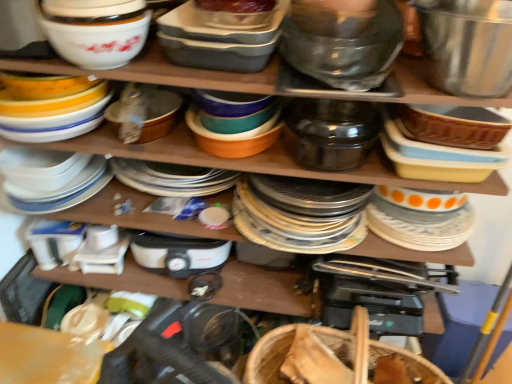
Describe the element at coordinates (52, 108) in the screenshot. I see `white glossy bowl at upper left, the 2th appliance when ordered from right to left` at that location.

Where is `white glossy plate at upper right`? white glossy plate at upper right is located at coordinates (419, 219).

In order to face translucent plastic container at upper center, which is the 2th bowl in left-to-right order, should I rotate leftwards or rightwards?

You should rotate left by 3.914 degrees.

Measure the distance between point (483, 61) and camera.

Point (483, 61) and camera are 29.21 inches apart.

At what (x,y) coordinates should I click in order to perform the action: click on transparent plastic bowl at upper center, which is the second bowl from right to left. Please return your answer as a coordinate pair (x, y). The height and width of the screenshot is (384, 512). Looking at the image, I should click on click(x=342, y=44).

Identify the location of white glossy bowl at upper left, the 1th bowl in the left-to-right sequence. The height and width of the screenshot is (384, 512). (96, 30).

From a real-world perspective, does shiny metallic bowl at upper right, arranged as the fourth bowl when viewed from the left, stand above white glossy bowl at upper left, the 2th appliance when ordered from right to left?

Yes.

From the image's perspective, which bowl is the 1st one above the white glossy bowl at upper left, positioned as the 1th appliance in left-to-right order? Please provide its 2D coordinates.

[(467, 45)]

Is shiny metallic bowl at upper right, arranged as the first bowl when viewed from the right, bigger than white glossy bowl at upper left, the 2th appliance when ordered from right to left?

Actually, shiny metallic bowl at upper right, arranged as the first bowl when viewed from the right, might be smaller than white glossy bowl at upper left, the 2th appliance when ordered from right to left.

Measure the distance between shiny metallic bowl at upper right, arranged as the first bowl when viewed from the right, and white glossy bowl at upper left, the 2th appliance when ordered from right to left.

shiny metallic bowl at upper right, arranged as the first bowl when viewed from the right, is 31.59 inches away from white glossy bowl at upper left, the 2th appliance when ordered from right to left.

I want to click on the 1st appliance behind the shiny metallic bowl at upper right, arranged as the first bowl when viewed from the right, counting from the anchor's position, so click(x=330, y=133).

From a real-world perspective, relative to shiny metallic bowl at upper right, arranged as the fourth bowl when viewed from the left, is satin black pot at center, which is the 1th appliance in right-to-left order, vertically above or below?

From a real-world perspective, satin black pot at center, which is the 1th appliance in right-to-left order, is physically below shiny metallic bowl at upper right, arranged as the fourth bowl when viewed from the left.

Is satin black pot at center, which is counted as the 2th appliance, starting from the left, not inside shiny metallic bowl at upper right, arranged as the first bowl when viewed from the right?

Yes, satin black pot at center, which is counted as the 2th appliance, starting from the left, is not within shiny metallic bowl at upper right, arranged as the first bowl when viewed from the right.

Which is in front, satin black pot at center, which is the 1th appliance in right-to-left order, or shiny metallic bowl at upper right, arranged as the first bowl when viewed from the right?

Positioned in front is shiny metallic bowl at upper right, arranged as the first bowl when viewed from the right.

Based on the photo, considering the relative sizes of white glossy plate at upper right and shiny metallic bowl at upper right, arranged as the first bowl when viewed from the right, in the image provided, is white glossy plate at upper right smaller than shiny metallic bowl at upper right, arranged as the first bowl when viewed from the right,?

Yes.

Based on the photo, from the image's perspective, relative to shiny metallic bowl at upper right, arranged as the fourth bowl when viewed from the left, is white glossy plate at upper right above or below?

From the image's perspective, white glossy plate at upper right appears below shiny metallic bowl at upper right, arranged as the fourth bowl when viewed from the left.

Is white glossy plate at upper right aimed at shiny metallic bowl at upper right, arranged as the fourth bowl when viewed from the left?

No, white glossy plate at upper right is not facing towards shiny metallic bowl at upper right, arranged as the fourth bowl when viewed from the left.

Does white glossy plate at upper right have a greater width compared to transparent plastic bowl at upper center, marked as the 3th bowl in a left-to-right arrangement?

No, white glossy plate at upper right is not wider than transparent plastic bowl at upper center, marked as the 3th bowl in a left-to-right arrangement.

In terms of height, does white glossy plate at upper right look taller or shorter compared to transparent plastic bowl at upper center, which is the second bowl from right to left?

In the image, white glossy plate at upper right appears to be shorter than transparent plastic bowl at upper center, which is the second bowl from right to left.

Are white glossy plate at upper right and transparent plastic bowl at upper center, which is the second bowl from right to left, far apart?

No, there isn't a large distance between white glossy plate at upper right and transparent plastic bowl at upper center, which is the second bowl from right to left.

The width and height of the screenshot is (512, 384). In order to click on tableware below the transparent plastic bowl at upper center, which is the second bowl from right to left (from a real-world perspective) in this screenshot , I will do click(x=419, y=219).

From a real-world perspective, between translucent plastic container at upper center, which is the 3th bowl in right-to-left order, and transparent plastic bowl at upper center, which is the second bowl from right to left, who is vertically lower?

transparent plastic bowl at upper center, which is the second bowl from right to left, is physically lower.

Which is more to the right, translucent plastic container at upper center, which is the 3th bowl in right-to-left order, or transparent plastic bowl at upper center, marked as the 3th bowl in a left-to-right arrangement?

Positioned to the right is transparent plastic bowl at upper center, marked as the 3th bowl in a left-to-right arrangement.

Can transparent plastic bowl at upper center, marked as the 3th bowl in a left-to-right arrangement, be found inside translucent plastic container at upper center, which is the 3th bowl in right-to-left order?

No, translucent plastic container at upper center, which is the 3th bowl in right-to-left order, does not contain transparent plastic bowl at upper center, marked as the 3th bowl in a left-to-right arrangement.

Considering the relative sizes of bamboo weave basket at lower center and white glossy bowl at upper left, the 2th appliance when ordered from right to left, in the image provided, is bamboo weave basket at lower center wider than white glossy bowl at upper left, the 2th appliance when ordered from right to left,?

In fact, bamboo weave basket at lower center might be narrower than white glossy bowl at upper left, the 2th appliance when ordered from right to left.

Considering the relative sizes of bamboo weave basket at lower center and white glossy bowl at upper left, the 2th appliance when ordered from right to left, in the image provided, is bamboo weave basket at lower center bigger than white glossy bowl at upper left, the 2th appliance when ordered from right to left,?

Indeed, bamboo weave basket at lower center has a larger size compared to white glossy bowl at upper left, the 2th appliance when ordered from right to left.

In the image, is bamboo weave basket at lower center on the left side or the right side of white glossy bowl at upper left, the 2th appliance when ordered from right to left?

bamboo weave basket at lower center is positioned on white glossy bowl at upper left, the 2th appliance when ordered from right to left,'s right side.

Considering the points (391, 363) and (13, 127), which point is in front, point (391, 363) or point (13, 127)?

The point (13, 127) is in front.

From a real-world perspective, is shiny metallic bowl at upper right, arranged as the first bowl when viewed from the right, physically above satin black pot at center, which is counted as the 2th appliance, starting from the left?

Yes, from a real-world perspective, shiny metallic bowl at upper right, arranged as the first bowl when viewed from the right, is on top of satin black pot at center, which is counted as the 2th appliance, starting from the left.

Is shiny metallic bowl at upper right, arranged as the fourth bowl when viewed from the left, oriented towards satin black pot at center, which is counted as the 2th appliance, starting from the left?

No, shiny metallic bowl at upper right, arranged as the fourth bowl when viewed from the left, does not turn towards satin black pot at center, which is counted as the 2th appliance, starting from the left.

From the image's perspective, which is below, shiny metallic bowl at upper right, arranged as the first bowl when viewed from the right, or satin black pot at center, which is counted as the 2th appliance, starting from the left?

satin black pot at center, which is counted as the 2th appliance, starting from the left.

Can you confirm if shiny metallic bowl at upper right, arranged as the first bowl when viewed from the right, is thinner than satin black pot at center, which is the 1th appliance in right-to-left order?

No, shiny metallic bowl at upper right, arranged as the first bowl when viewed from the right, is not thinner than satin black pot at center, which is the 1th appliance in right-to-left order.

You are a GUI agent. You are given a task and a screenshot of the screen. Output one action in this format:
    pyautogui.click(x=<x>, y=<y>)
    Task: Click on the 3rd bowl above the white glossy bowl at upper left, positioned as the 1th appliance in left-to-right order (from a real-world perspective)
    This screenshot has width=512, height=384.
    Given the screenshot: What is the action you would take?
    pyautogui.click(x=467, y=45)

From a real-world perspective, starting from the shiny metallic bowl at upper right, arranged as the first bowl when viewed from the right, which appliance is the 2nd one below it? Please provide its 2D coordinates.

[(330, 133)]

When comparing their distances from white glossy bowl at upper left, the 2th appliance when ordered from right to left, does bamboo weave basket at lower center or white glossy bowl at upper left, marked as the 4th bowl in a right-to-left arrangement, seem further?

Based on the image, bamboo weave basket at lower center appears to be further to white glossy bowl at upper left, the 2th appliance when ordered from right to left.

From the image, which object appears to be farther from white glossy bowl at upper left, marked as the 4th bowl in a right-to-left arrangement, satin black pot at center, which is the 1th appliance in right-to-left order, or bamboo weave basket at lower center?

Among the two, bamboo weave basket at lower center is located further to white glossy bowl at upper left, marked as the 4th bowl in a right-to-left arrangement.

When comparing their distances from transparent plastic bowl at upper center, marked as the 3th bowl in a left-to-right arrangement, does shiny metallic bowl at upper right, arranged as the first bowl when viewed from the right, or translucent plastic container at upper center, which is the 2th bowl in left-to-right order, seem closer?

The object closer to transparent plastic bowl at upper center, marked as the 3th bowl in a left-to-right arrangement, is shiny metallic bowl at upper right, arranged as the first bowl when viewed from the right.

Estimate the real-world distances between objects in this image. Which object is closer to white glossy plate at upper right, shiny metallic bowl at upper right, arranged as the fourth bowl when viewed from the left, or white glossy bowl at upper left, the 1th bowl in the left-to-right sequence?

shiny metallic bowl at upper right, arranged as the fourth bowl when viewed from the left.

Looking at the image, which one is located further to transparent plastic bowl at upper center, which is the second bowl from right to left, white glossy bowl at upper left, the 1th bowl in the left-to-right sequence, or white glossy plate at upper right?

white glossy bowl at upper left, the 1th bowl in the left-to-right sequence, lies further to transparent plastic bowl at upper center, which is the second bowl from right to left, than the other object.

Estimate the real-world distances between objects in this image. Which object is closer to satin black pot at center, which is the 1th appliance in right-to-left order, white glossy bowl at upper left, the 1th bowl in the left-to-right sequence, or bamboo weave basket at lower center?

Among the two, bamboo weave basket at lower center is located nearer to satin black pot at center, which is the 1th appliance in right-to-left order.

In the scene shown: Considering their positions, is white glossy plate at upper right positioned closer to shiny metallic bowl at upper right, arranged as the first bowl when viewed from the right, than white glossy bowl at upper left, the 1th bowl in the left-to-right sequence?

white glossy plate at upper right.

Looking at the image, which one is located closer to white glossy bowl at upper left, marked as the 4th bowl in a right-to-left arrangement, satin black pot at center, which is counted as the 2th appliance, starting from the left, or transparent plastic bowl at upper center, which is the second bowl from right to left?

transparent plastic bowl at upper center, which is the second bowl from right to left, is positioned closer to the anchor white glossy bowl at upper left, marked as the 4th bowl in a right-to-left arrangement.

Locate an element on the screen. The width and height of the screenshot is (512, 384). appliance located between white glossy bowl at upper left, the 1th bowl in the left-to-right sequence, and shiny metallic bowl at upper right, arranged as the first bowl when viewed from the right, in the left-right direction is located at coordinates (330, 133).

Identify the location of appliance situated between white glossy bowl at upper left, positioned as the 1th appliance in left-to-right order, and bamboo weave basket at lower center from left to right. (330, 133).

This screenshot has height=384, width=512. Find the location of `appliance between white glossy bowl at upper left, the 1th bowl in the left-to-right sequence, and transparent plastic bowl at upper center, marked as the 3th bowl in a left-to-right arrangement`. appliance between white glossy bowl at upper left, the 1th bowl in the left-to-right sequence, and transparent plastic bowl at upper center, marked as the 3th bowl in a left-to-right arrangement is located at coordinates (330, 133).

Where is `bowl between transparent plastic bowl at upper center, which is the second bowl from right to left, and white glossy plate at upper right vertically`? This screenshot has width=512, height=384. bowl between transparent plastic bowl at upper center, which is the second bowl from right to left, and white glossy plate at upper right vertically is located at coordinates (467, 45).